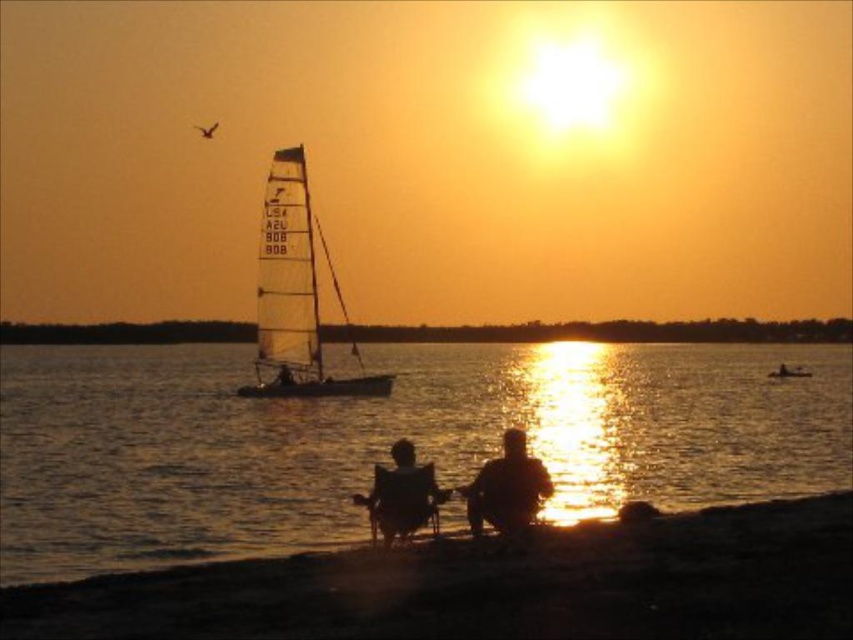
You are standing on the dark sand shoreline at lower center and want to reach the white translucent sailboat at center. Which direction should you walk to get closer to the sailboat?

The white translucent sailboat at center is located further away from the dark sand shoreline at lower center, so you should walk forward towards the center of the image to reach it.

You are standing at the point marked by the coordinates point (294,294), which is the white translucent sailboat at center. If you turn to face the direction of the sunset, which direction should you face?

The sun is positioned near the top right corner of the image. Since you are at the white translucent sailboat at center, facing the direction of the sunset would mean turning to face the top right direction.

You are a photographer planning to capture the sunset scene. You want to ensure that both the white translucent sailboat at center and the matte plastic chair at center are clearly visible in your shot. Based on their positions, which object will appear closer to the camera in the photo?

The white translucent sailboat at center is located above the matte plastic chair at center, so it will appear closer to the camera in the photo.